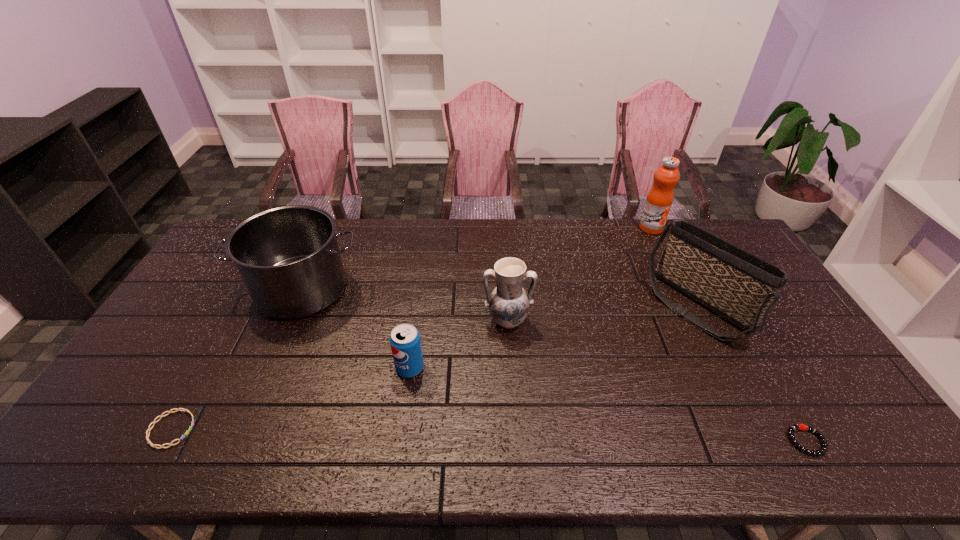
You are a GUI agent. You are given a task and a screenshot of the screen. Output one action in this format:
    pyautogui.click(x=<x>, y=<y>)
    Task: Click on the farthest object
    This screenshot has height=540, width=960.
    Given the screenshot: What is the action you would take?
    pyautogui.click(x=660, y=197)

Locate an element on the screen. The width and height of the screenshot is (960, 540). fruit juice is located at coordinates (660, 197).

Where is `saucepan`? The height and width of the screenshot is (540, 960). saucepan is located at coordinates (288, 257).

Identify the location of pottery. (508, 303).

This screenshot has height=540, width=960. In order to click on handbag in this screenshot , I will do `click(740, 287)`.

What are the coordinates of `the third nearest object` in the screenshot? It's located at (405, 342).

The image size is (960, 540). I want to click on soda can, so click(x=405, y=342).

Locate an element on the screen. Image resolution: width=960 pixels, height=540 pixels. the left bracelet is located at coordinates (185, 410).

Where is `the right bracelet`? The image size is (960, 540). the right bracelet is located at coordinates 794,427.

Locate an element on the screen. Image resolution: width=960 pixels, height=540 pixels. vacant position located 0.080m on the front label of the farthest object is located at coordinates (660, 248).